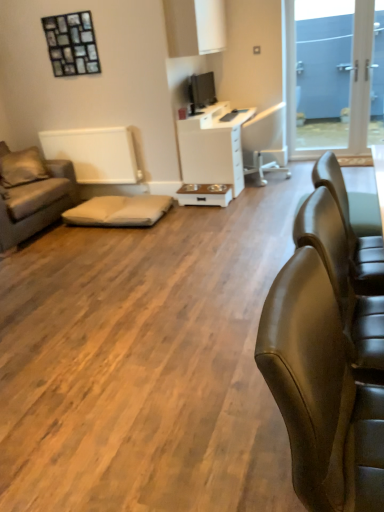
Question: Is leather couch at right, arranged as the 1th chair when viewed from the left, to the right of blue glass door at upper right from the viewer's perspective?

Choices:
 (A) no
 (B) yes

Answer: (A)

Question: Does leather couch at right, which is the 1th chair from bottom to top, have a smaller size compared to blue glass door at upper right?

Choices:
 (A) no
 (B) yes

Answer: (B)

Question: From the image's perspective, does leather couch at right, which is the 1th chair from bottom to top, appear lower than blue glass door at upper right?

Choices:
 (A) yes
 (B) no

Answer: (A)

Question: Is leather couch at right, the 2th chair in the right-to-left sequence, closer to camera compared to blue glass door at upper right?

Choices:
 (A) yes
 (B) no

Answer: (A)

Question: Is leather couch at right, placed as the second chair when sorted from top to bottom, placed right next to blue glass door at upper right?

Choices:
 (A) yes
 (B) no

Answer: (B)

Question: From their relative heights in the image, would you say matte black tv at upper center is taller or shorter than brown fabric couch at left?

Choices:
 (A) tall
 (B) short

Answer: (B)

Question: From a real-world perspective, relative to brown fabric couch at left, is matte black tv at upper center vertically above or below?

Choices:
 (A) above
 (B) below

Answer: (A)

Question: Would you say matte black tv at upper center is to the left or to the right of brown fabric couch at left in the picture?

Choices:
 (A) right
 (B) left

Answer: (A)

Question: In terms of size, does matte black tv at upper center appear bigger or smaller than brown fabric couch at left?

Choices:
 (A) big
 (B) small

Answer: (B)

Question: In terms of height, does beige fabric pillow at left look taller or shorter compared to white plastic chair at center?

Choices:
 (A) tall
 (B) short

Answer: (B)

Question: Is beige fabric pillow at left inside or outside of white plastic chair at center?

Choices:
 (A) inside
 (B) outside

Answer: (B)

Question: Considering the relative positions of beige fabric pillow at left and white plastic chair at center in the image provided, is beige fabric pillow at left to the left or to the right of white plastic chair at center?

Choices:
 (A) right
 (B) left

Answer: (B)

Question: In the image, is beige fabric pillow at left positioned in front of or behind white plastic chair at center?

Choices:
 (A) front
 (B) behind

Answer: (A)

Question: Considering the positions of beige fabric cushion at center and white plastic chair at center in the image, is beige fabric cushion at center wider or thinner than white plastic chair at center?

Choices:
 (A) thin
 (B) wide

Answer: (A)

Question: Considering their positions, is beige fabric cushion at center located in front of or behind white plastic chair at center?

Choices:
 (A) front
 (B) behind

Answer: (A)